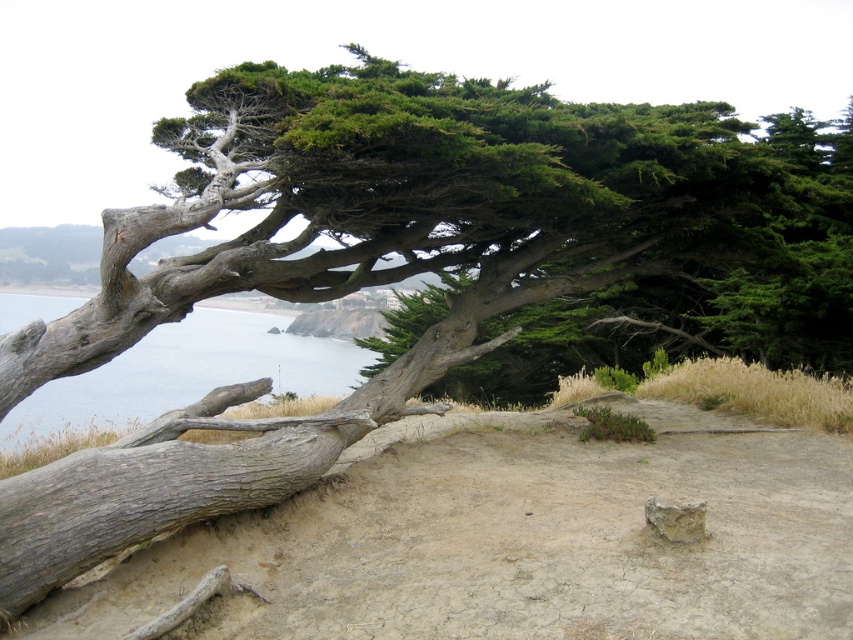
Consider the image. Between dull brown dirt at center and blue water at left, which one is positioned higher?

blue water at left is higher up.

Does dull brown dirt at center lie in front of blue water at left?

That is True.

Is point (454, 628) positioned behind point (229, 353)?

No, it is in front of (229, 353).

The width and height of the screenshot is (853, 640). I want to click on dull brown dirt at center, so click(x=508, y=541).